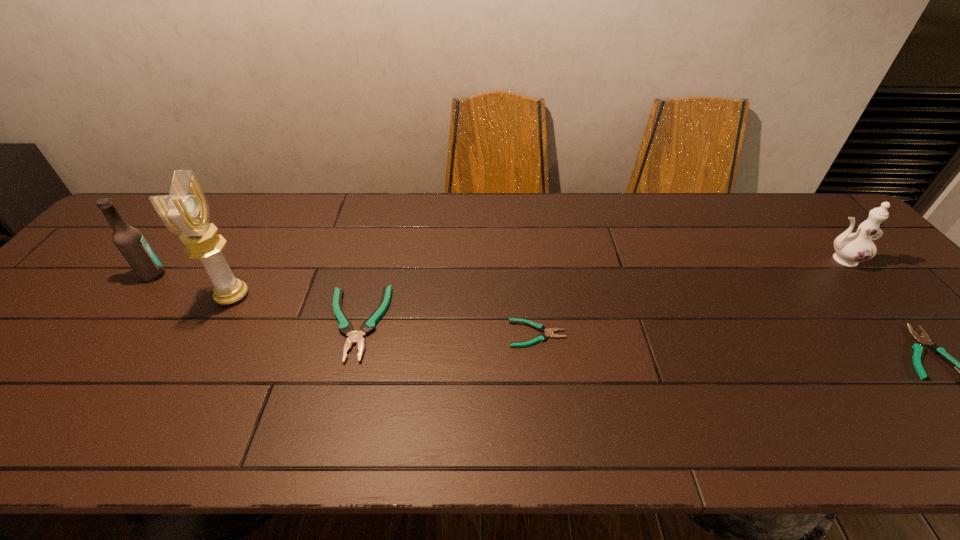
I want to click on spot to insert another pliers for uniform distribution, so click(x=727, y=345).